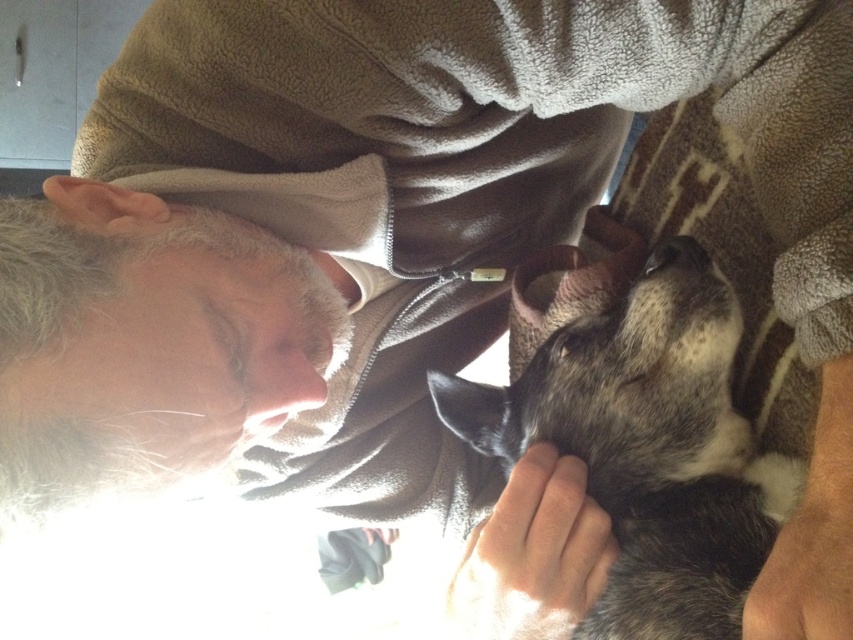
Is speckled fur dog at center bigger than smooth skin nose at center?

Indeed, speckled fur dog at center has a larger size compared to smooth skin nose at center.

Locate an element on the screen. speckled fur dog at center is located at coordinates (648, 445).